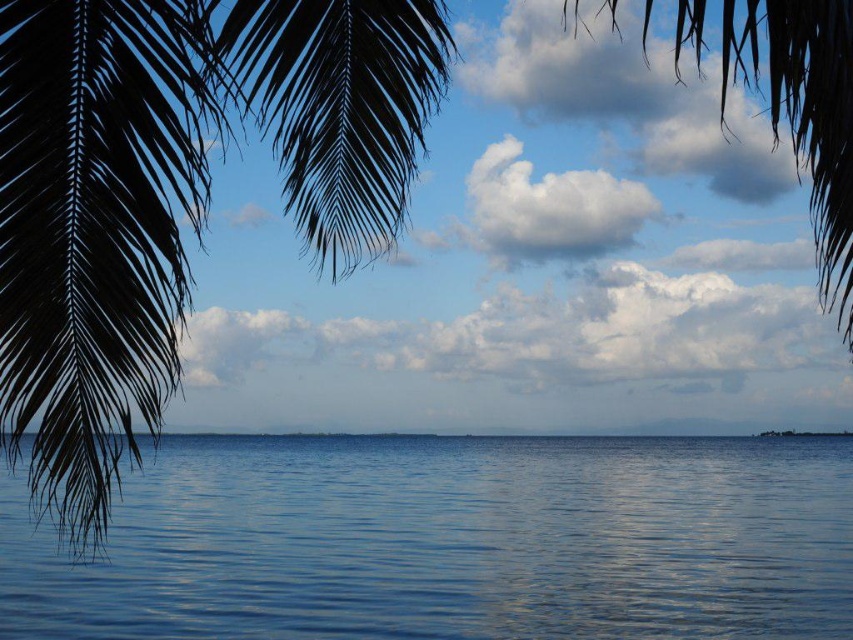
Does glossy blue water at center have a lesser width compared to dark green leafy palm tree at left?

No, glossy blue water at center is not thinner than dark green leafy palm tree at left.

Measure the distance from glossy blue water at center to dark green leafy palm tree at left.

They are 37.57 feet apart.

Image resolution: width=853 pixels, height=640 pixels. Describe the element at coordinates (451, 541) in the screenshot. I see `glossy blue water at center` at that location.

Identify the location of glossy blue water at center. (451, 541).

Who is more distant from viewer, (21, 609) or (816, 172)?

Positioned behind is point (21, 609).

Can you confirm if glossy blue water at center is positioned below silky brown leaf at upper center?

Yes.

Is point (3, 522) positioned in front of point (815, 156)?

No, (3, 522) is further to viewer.

The image size is (853, 640). I want to click on glossy blue water at center, so click(451, 541).

Is dark green leafy palm tree at left taller than silky brown leaf at upper center?

No, dark green leafy palm tree at left is not taller than silky brown leaf at upper center.

Is dark green leafy palm tree at left below silky brown leaf at upper center?

Yes, dark green leafy palm tree at left is below silky brown leaf at upper center.

Who is more distant from viewer, [352,16] or [677,4]?

Point [677,4]

Locate an element on the screen. This screenshot has height=640, width=853. dark green leafy palm tree at left is located at coordinates (173, 192).